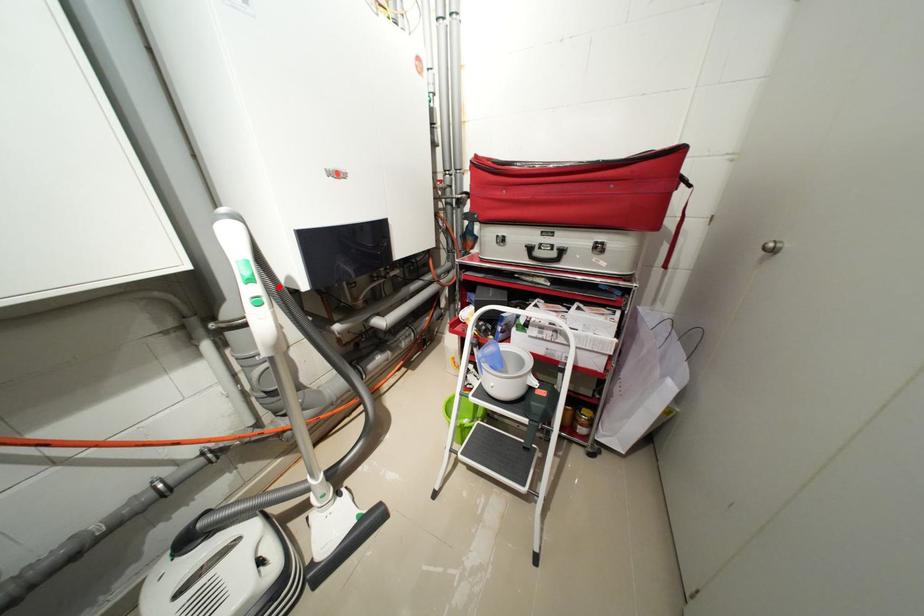
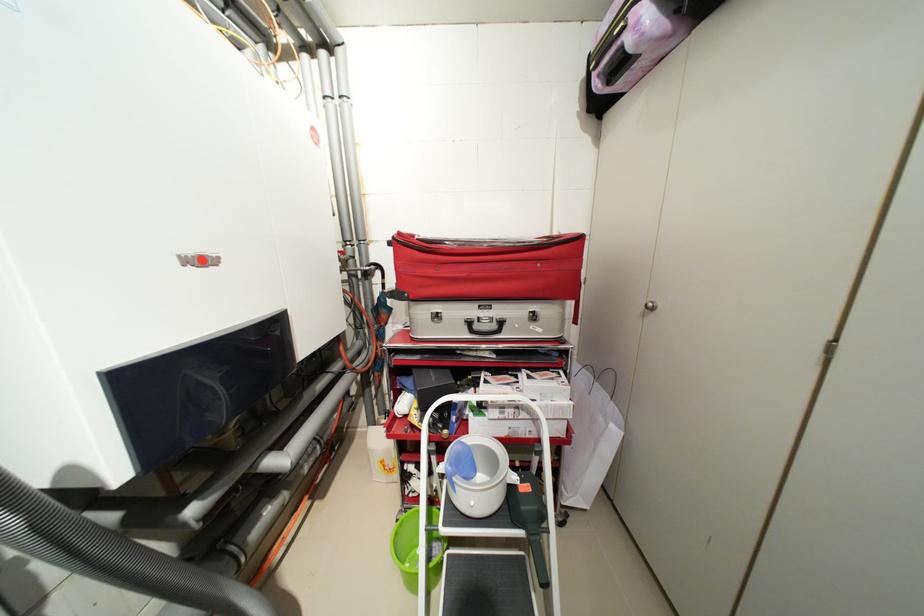
Where in the second image is the point corresponding to the highlighted location from the first image?

(19, 523)